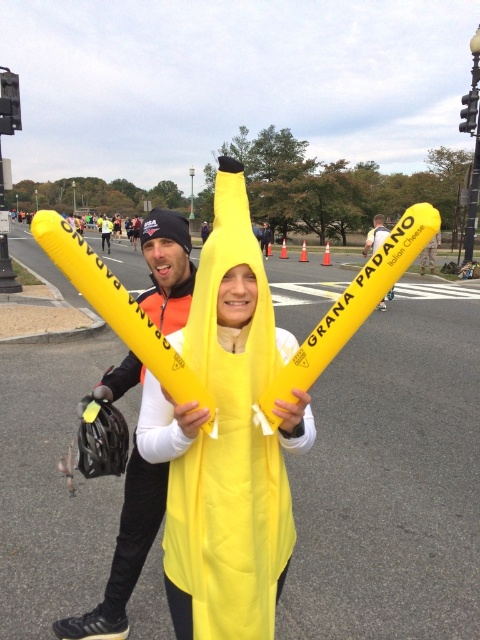
You are at an outdoor event and see two yellow items at the center of the scene. Which one is taller between the yellow fabric banana at center and the yellow matte balloon at center?

The yellow matte balloon at center is taller than the yellow fabric banana at center.

You are a photographer positioned at the origin point of the image. You need to capture a photo that includes both the person on the left in the black and orange cycling outfit and the individual in the bright yellow banana costume. Based on their positions relative to the central matte yellow baton, which is located at point (124, 552), where should you position your camera to ensure both subjects are in frame?

To include both the person on the left in the black and orange cycling outfit and the individual in the bright yellow banana costume, position the camera so that the central matte yellow baton at point (124, 552) is centered in the frame. This will ensure both subjects are visible on either side of the baton.